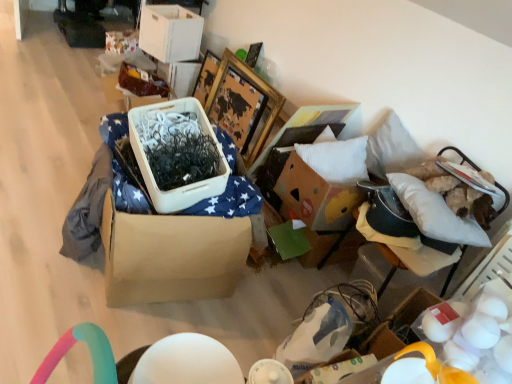
What are the coordinates of `vacant area on top of white cardboard storage box at upper center, arranged as the 1th storage box when viewed from the top (from a real-world perspective)` in the screenshot? It's located at (178, 10).